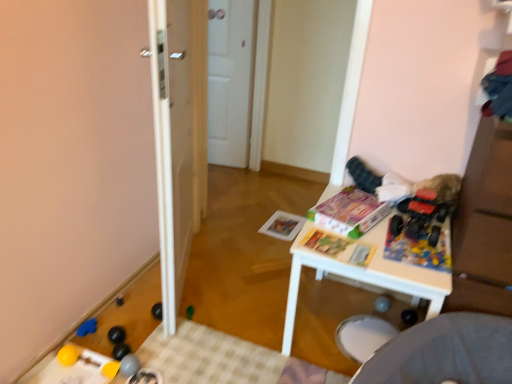
Question: In which direction should I rotate to look at matte paper magazine at center, which appears as the 3th magazine when viewed from the back?

Choices:
 (A) left
 (B) right

Answer: (B)

Question: Is rubber yellow ball at lower left, which is the 4th toy from right to left, smaller than white matte door at center?

Choices:
 (A) yes
 (B) no

Answer: (A)

Question: From the image's perspective, is rubber yellow ball at lower left, which is counted as the 1th toy, starting from the bottom, located above white matte door at center?

Choices:
 (A) no
 (B) yes

Answer: (A)

Question: Does rubber yellow ball at lower left, which is counted as the 1th toy, starting from the bottom, appear on the left side of white matte door at center?

Choices:
 (A) yes
 (B) no

Answer: (A)

Question: Can you confirm if rubber yellow ball at lower left, arranged as the sixth toy when viewed from the top, is taller than white matte door at center?

Choices:
 (A) yes
 (B) no

Answer: (B)

Question: Does rubber yellow ball at lower left, placed as the 3th toy when sorted from left to right, have a greater width compared to white matte door at center?

Choices:
 (A) yes
 (B) no

Answer: (B)

Question: Is rubber yellow ball at lower left, arranged as the sixth toy when viewed from the top, thinner than white matte door at center?

Choices:
 (A) no
 (B) yes

Answer: (B)

Question: Is matte paper magazine at center, which is the 1th magazine in back-to-front order, behind white matte door at center?

Choices:
 (A) yes
 (B) no

Answer: (B)

Question: Is matte paper magazine at center, positioned as the third magazine in front-to-back order, positioned beyond the bounds of white matte door at center?

Choices:
 (A) yes
 (B) no

Answer: (A)

Question: Considering the relative sizes of matte paper magazine at center, positioned as the third magazine in front-to-back order, and white matte door at center in the image provided, is matte paper magazine at center, positioned as the third magazine in front-to-back order, taller than white matte door at center?

Choices:
 (A) yes
 (B) no

Answer: (B)

Question: Does matte paper magazine at center, positioned as the third magazine in front-to-back order, have a larger size compared to white matte door at center?

Choices:
 (A) yes
 (B) no

Answer: (B)

Question: From a real-world perspective, is matte paper magazine at center, which is the 1th magazine in back-to-front order, on top of white matte door at center?

Choices:
 (A) yes
 (B) no

Answer: (B)

Question: Is matte paper magazine at center, positioned as the third magazine in front-to-back order, in contact with white matte door at center?

Choices:
 (A) yes
 (B) no

Answer: (B)

Question: Is matte paper magazine at center, which appears as the 3th magazine when viewed from the back, far away from white glossy door at center?

Choices:
 (A) no
 (B) yes

Answer: (A)